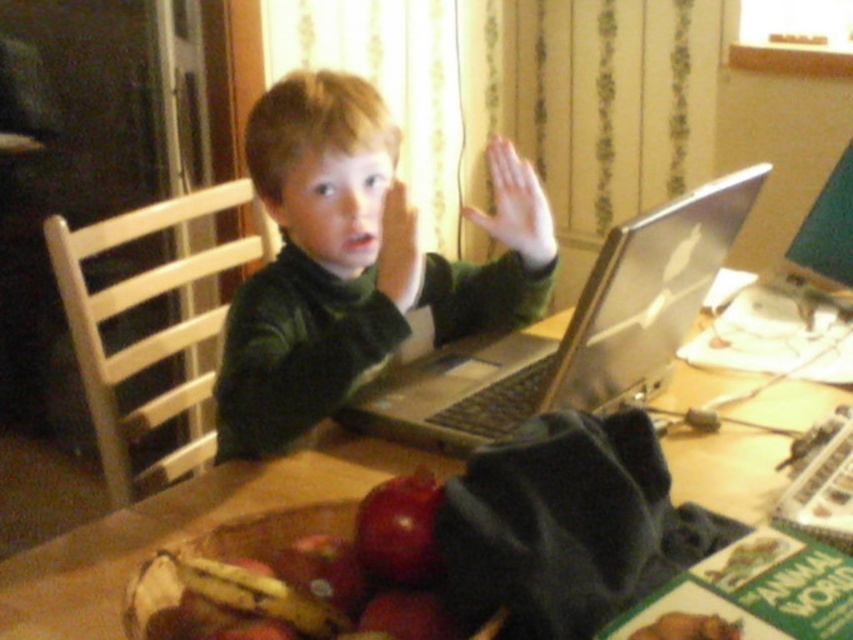
You are a teacher observing a classroom. You notice a silver metallic laptop at center and a red matte apple at lower center on the table. Which object is taller?

The silver metallic laptop at center is taller than the red matte apple at lower center.

The child is trying to place the shiny red apple at center on top of the silver metallic laptop at center. Based on their sizes, will the apple fit on the laptop?

The silver metallic laptop at center is larger in size than shiny red apple at center, so the apple can fit on the laptop.

You are a photographer taking a picture of the scene. You notice a point at coordinates (573, 332). Which object in the scene is this point located on?

The point at coordinates (573, 332) is located on the silver metallic laptop at center.